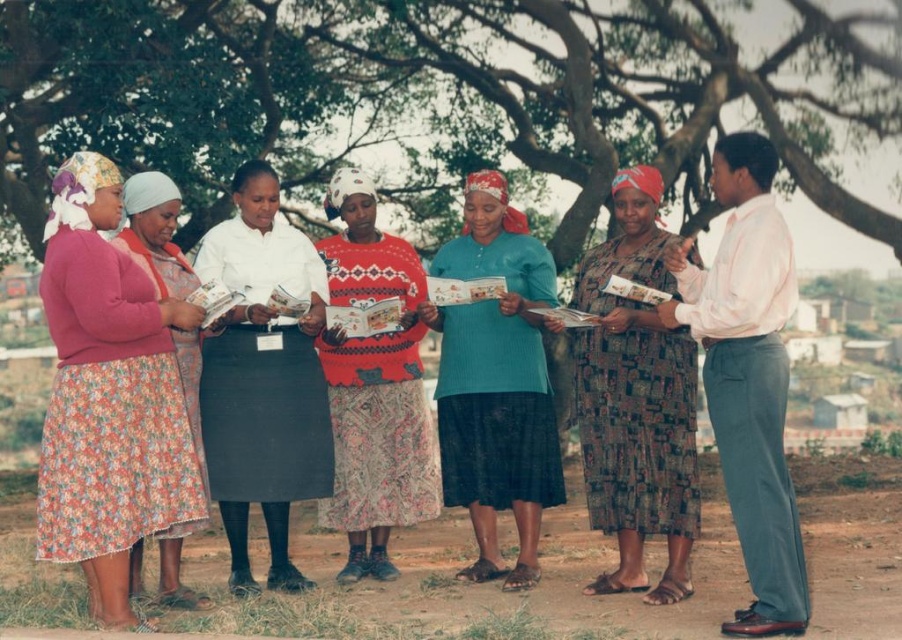
Can you confirm if green leafy tree at upper center is thinner than knitted sweater at center?

No, green leafy tree at upper center is not thinner than knitted sweater at center.

The height and width of the screenshot is (640, 902). I want to click on green leafy tree at upper center, so click(x=433, y=92).

Is point (171, 147) behind point (336, 410)?

Yes, it is.

This screenshot has height=640, width=902. What are the coordinates of `green leafy tree at upper center` in the screenshot? It's located at (433, 92).

Is white matte skirt at center further to the viewer compared to printed fabric dress at center?

Yes, white matte skirt at center is behind printed fabric dress at center.

Between point (240, 465) and point (595, 288), which one is positioned in front?

Point (595, 288)

This screenshot has width=902, height=640. Find the location of `white matte skirt at center`. white matte skirt at center is located at coordinates (263, 378).

From the picture: Is green leafy tree at upper center shorter than light pink cotton shirt at right?

In fact, green leafy tree at upper center may be taller than light pink cotton shirt at right.

Is point (204, 180) in front of point (750, 528)?

No, (204, 180) is behind (750, 528).

Where is `green leafy tree at upper center`? green leafy tree at upper center is located at coordinates (433, 92).